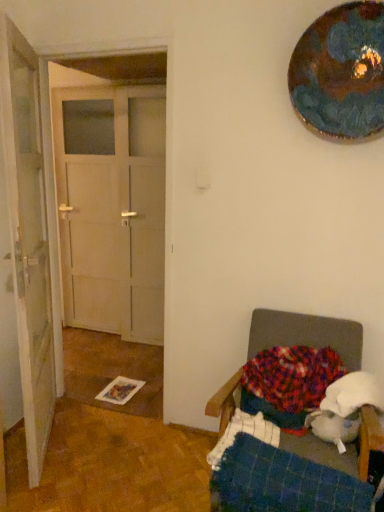
Locate an element on the screen. This screenshot has width=384, height=512. vacant space underneath white wooden door at left, acting as the 1th door starting from the left (from a real-world perspective) is located at coordinates (54, 441).